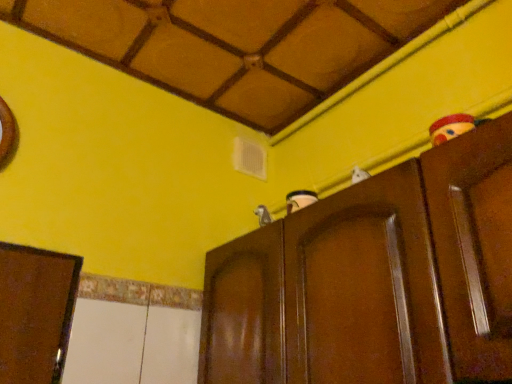
Image resolution: width=512 pixels, height=384 pixels. What do you see at coordinates (474, 247) in the screenshot? I see `brown glossy door at upper right` at bounding box center [474, 247].

Identify the location of brown glossy door at upper right. (474, 247).

What do you see at coordinates (375, 279) in the screenshot? The width and height of the screenshot is (512, 384). I see `brown wooden cupboard at upper center` at bounding box center [375, 279].

Locate an element on the screen. Image resolution: width=512 pixels, height=384 pixels. brown wooden cupboard at upper center is located at coordinates (375, 279).

You are a GUI agent. You are given a task and a screenshot of the screen. Output one action in this format:
    pyautogui.click(x=<x>, y=<y>)
    Task: Click on the brown glossy door at upper right
    The width and height of the screenshot is (512, 384).
    Given the screenshot: What is the action you would take?
    pyautogui.click(x=474, y=247)

Does brown wooden cupboard at upper center appear on the right side of brown glossy door at upper right?

In fact, brown wooden cupboard at upper center is to the left of brown glossy door at upper right.

Considering the relative positions of brown wooden cupboard at upper center and brown glossy door at upper right in the image provided, is brown wooden cupboard at upper center in front of brown glossy door at upper right?

No, brown wooden cupboard at upper center is behind brown glossy door at upper right.

Which is nearer, [444,146] or [446,285]?

Point [444,146].

From the image's perspective, would you say brown wooden cupboard at upper center is shown under brown glossy door at upper right?

Yes, from the image's perspective, brown wooden cupboard at upper center is beneath brown glossy door at upper right.

From a real-world perspective, is brown wooden cupboard at upper center under brown glossy door at upper right?

Yes, from a real-world perspective, brown wooden cupboard at upper center is beneath brown glossy door at upper right.

Which of these two, brown wooden cupboard at upper center or brown glossy door at upper right, is wider?

Wider between the two is brown wooden cupboard at upper center.

Which of these two, brown wooden cupboard at upper center or brown glossy door at upper right, stands shorter?

brown glossy door at upper right.

Looking at this image, considering the sizes of objects brown wooden cupboard at upper center and brown glossy door at upper right in the image provided, who is bigger, brown wooden cupboard at upper center or brown glossy door at upper right?

brown wooden cupboard at upper center.

Is brown wooden cupboard at upper center not within brown glossy door at upper right?

Yes, brown wooden cupboard at upper center is outside of brown glossy door at upper right.

Is brown wooden cupboard at upper center not close to brown glossy door at upper right?

No, brown wooden cupboard at upper center is not far from brown glossy door at upper right.

Does brown wooden cupboard at upper center turn towards brown glossy door at upper right?

No, brown wooden cupboard at upper center does not turn towards brown glossy door at upper right.

Can you tell me how much brown wooden cupboard at upper center and brown glossy door at upper right differ in facing direction?

The angle between the facing direction of brown wooden cupboard at upper center and the facing direction of brown glossy door at upper right is 0.000558 degrees.

This screenshot has width=512, height=384. I want to click on door on the right of brown wooden cupboard at upper center, so click(x=474, y=247).

Which object is positioned more to the left, brown glossy door at upper right or brown wooden cupboard at upper center?

Positioned to the left is brown wooden cupboard at upper center.

Considering their positions, is brown glossy door at upper right located in front of or behind brown wooden cupboard at upper center?

In the image, brown glossy door at upper right appears in front of brown wooden cupboard at upper center.

Considering the positions of point (501, 145) and point (251, 366), is point (501, 145) closer or farther from the camera than point (251, 366)?

Point (501, 145).

From the image's perspective, is brown glossy door at upper right on brown wooden cupboard at upper center?

Correct, brown glossy door at upper right appears higher than brown wooden cupboard at upper center in the image.

From a real-world perspective, which object stands above the other?

brown glossy door at upper right.

Which object is wider, brown glossy door at upper right or brown wooden cupboard at upper center?

brown wooden cupboard at upper center.

Based on the photo, is brown glossy door at upper right taller or shorter than brown wooden cupboard at upper center?

Clearly, brown glossy door at upper right is shorter compared to brown wooden cupboard at upper center.

Does brown glossy door at upper right have a larger size compared to brown wooden cupboard at upper center?

No.

Is brown glossy door at upper right surrounding brown wooden cupboard at upper center?

No, brown glossy door at upper right does not contain brown wooden cupboard at upper center.

Does brown glossy door at upper right touch brown wooden cupboard at upper center?

brown glossy door at upper right is not next to brown wooden cupboard at upper center, and they're not touching.

Is brown glossy door at upper right oriented away from brown wooden cupboard at upper center?

That's not correct — brown glossy door at upper right is not looking away from brown wooden cupboard at upper center.

Where is `door lying above the brown wooden cupboard at upper center (from the image's perspective)`? door lying above the brown wooden cupboard at upper center (from the image's perspective) is located at coordinates (474, 247).

This screenshot has height=384, width=512. I want to click on door on the right of brown wooden cupboard at upper center, so click(474, 247).

Find the location of a particular element. cupboard below the brown glossy door at upper right (from a real-world perspective) is located at coordinates (375, 279).